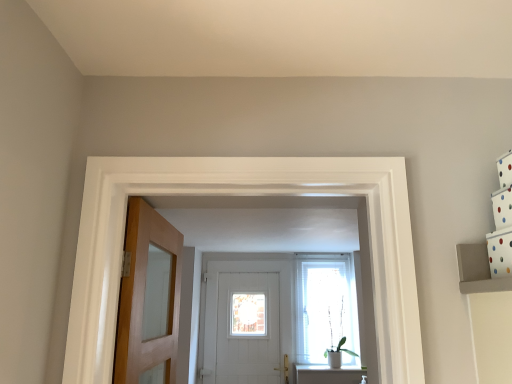
Question: From the image's perspective, is light brown wooden door at left, the 1th door from the top, located beneath translucent fabric at center?

Choices:
 (A) yes
 (B) no

Answer: (B)

Question: Is light brown wooden door at left, acting as the first door starting from the front, far away from translucent fabric at center?

Choices:
 (A) yes
 (B) no

Answer: (A)

Question: Is light brown wooden door at left, acting as the first door starting from the front, oriented towards translucent fabric at center?

Choices:
 (A) yes
 (B) no

Answer: (B)

Question: Does light brown wooden door at left, the 1th door from the top, have a greater height compared to translucent fabric at center?

Choices:
 (A) no
 (B) yes

Answer: (A)

Question: Is translucent fabric at center completely or partially inside light brown wooden door at left, acting as the first door starting from the front?

Choices:
 (A) no
 (B) yes

Answer: (A)

Question: Does light brown wooden door at left, which is the 2th door from bottom to top, come in front of translucent fabric at center?

Choices:
 (A) no
 (B) yes

Answer: (B)

Question: Is green matte plant at center aimed at white wooden door at center, arranged as the second door when viewed from the top?

Choices:
 (A) yes
 (B) no

Answer: (B)

Question: Is green matte plant at center further to the viewer compared to white wooden door at center, marked as the 1th door in a back-to-front arrangement?

Choices:
 (A) no
 (B) yes

Answer: (A)

Question: Is green matte plant at center closer to the viewer compared to white wooden door at center, the 2th door viewed from the front?

Choices:
 (A) yes
 (B) no

Answer: (A)

Question: Is green matte plant at center at the right side of white wooden door at center, which is counted as the first door, starting from the bottom?

Choices:
 (A) yes
 (B) no

Answer: (A)

Question: From the image's perspective, does green matte plant at center appear lower than white wooden door at center, the 2th door viewed from the front?

Choices:
 (A) no
 (B) yes

Answer: (B)

Question: Can you confirm if green matte plant at center is thinner than white wooden door at center, which is counted as the first door, starting from the bottom?

Choices:
 (A) yes
 (B) no

Answer: (B)

Question: Is the depth of white wooden door at center, marked as the 1th door in a back-to-front arrangement, less than that of translucent fabric at center?

Choices:
 (A) yes
 (B) no

Answer: (A)